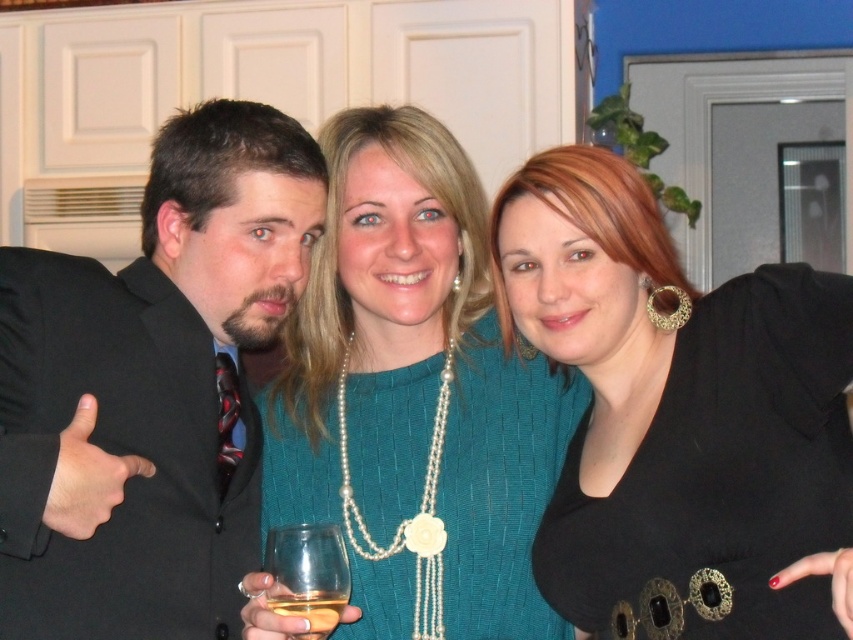
You are standing at the position of the viewer. There is a point at coordinates point (380,488). Can you reach this point with your outstretched hand?

The point (380,488) is 1.61 meters from the viewer, so you cannot reach it with your outstretched hand since it is too far away.

You are taking a photo of the scene and want to focus on both the point at point (686, 556) and the point at point (369, 602). Which point should you focus on first to ensure both are in sharp focus?

You should focus on point (686, 556) first because it is closer to the camera than point (369, 602). This ensures that both points will be within the depth of field when focusing on the closer point.

You are at a party and see two glasses at the center of the table. You want to pour red wine into the taller glass. Which glass should you choose between the clear glass wine glass at center and the translucent glass at center?

The clear glass wine glass at center is taller than the translucent glass at center, so you should choose the clear glass wine glass at center to pour the red wine.